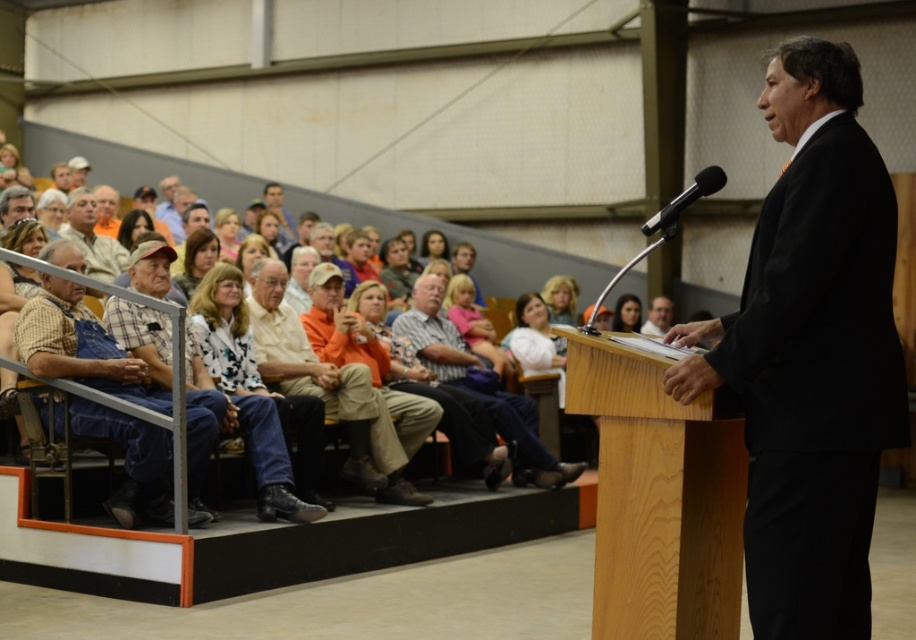
Does plaid shirt at center appear over matte black shirt at upper left?

No, plaid shirt at center is not above matte black shirt at upper left.

Measure the distance between plaid shirt at center and camera.

plaid shirt at center and camera are 8.66 meters apart from each other.

You are a GUI agent. You are given a task and a screenshot of the screen. Output one action in this format:
    pyautogui.click(x=<x>, y=<y>)
    Task: Click on the plaid shirt at center
    
    Given the screenshot: What is the action you would take?
    pyautogui.click(x=478, y=385)

Which is behind, point (626, 292) or point (445, 259)?

The point (445, 259) is behind.

Which is more to the left, dark brown hair at upper center or matte orange shirt at center?

From the viewer's perspective, matte orange shirt at center appears more on the left side.

Image resolution: width=916 pixels, height=640 pixels. What do you see at coordinates (626, 314) in the screenshot? I see `dark brown hair at upper center` at bounding box center [626, 314].

Image resolution: width=916 pixels, height=640 pixels. Find the location of `dark brown hair at upper center`. dark brown hair at upper center is located at coordinates [x=626, y=314].

Is black suit at center to the left of matte orange shirt at center from the viewer's perspective?

No, black suit at center is not to the left of matte orange shirt at center.

Does black suit at center have a lesser width compared to matte orange shirt at center?

No, black suit at center is not thinner than matte orange shirt at center.

Who is more distant from viewer, [764,550] or [437,230]?

Point [437,230]

Where is `black suit at center`? The height and width of the screenshot is (640, 916). black suit at center is located at coordinates (811, 353).